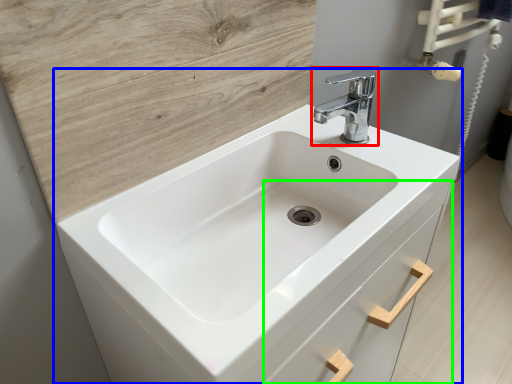
Question: Considering the real-world distances, which object is closest to tap (highlighted by a red box)? sink (highlighted by a blue box) or drawer (highlighted by a green box).

Choices:
 (A) sink
 (B) drawer

Answer: (A)